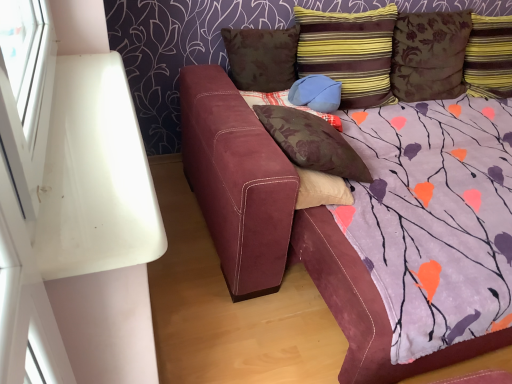
Where is `suede couch at center`? Image resolution: width=512 pixels, height=384 pixels. suede couch at center is located at coordinates (286, 228).

Identify the location of striped fabric pillow at upper right, the sixth pillow positioned from the left. (489, 57).

Measure the distance between floral fabric pillow at center, positioned as the 2th pillow in left-to-right order, and camera.

The distance of floral fabric pillow at center, positioned as the 2th pillow in left-to-right order, from camera is 4.74 feet.

This screenshot has width=512, height=384. What do you see at coordinates (349, 52) in the screenshot?
I see `striped fabric pillow at upper right, the 3th pillow viewed from the right` at bounding box center [349, 52].

Locate an element on the screen. The height and width of the screenshot is (384, 512). brown floral pillow at upper center, positioned as the sixth pillow in right-to-left order is located at coordinates (262, 58).

Is brown floral pillow at upper center, the 1th pillow positioned from the left, a part of brown floral pillow at upper right, placed as the second pillow when sorted from right to left?

No, brown floral pillow at upper center, the 1th pillow positioned from the left, is not surrounded by brown floral pillow at upper right, placed as the second pillow when sorted from right to left.

From the brown floral pillow at upper right, the 5th pillow positioned from the left, count the 4th pillow to the left and point to it. Please provide its 2D coordinates.

[(262, 58)]

From the picture: In terms of size, does brown floral pillow at upper right, placed as the second pillow when sorted from right to left, appear bigger or smaller than brown floral pillow at upper center, positioned as the sixth pillow in right-to-left order?

Clearly, brown floral pillow at upper right, placed as the second pillow when sorted from right to left, is larger in size than brown floral pillow at upper center, positioned as the sixth pillow in right-to-left order.

From the image's perspective, is brown floral pillow at upper right, the 5th pillow positioned from the left, beneath brown floral pillow at upper center, positioned as the sixth pillow in right-to-left order?

No.

Is brown floral pillow at upper right, the 5th pillow positioned from the left, wider or thinner than striped fabric pillow at upper right, which appears as the fourth pillow when viewed from the left?

Clearly, brown floral pillow at upper right, the 5th pillow positioned from the left, has less width compared to striped fabric pillow at upper right, which appears as the fourth pillow when viewed from the left.

Which object is positioned more to the left, brown floral pillow at upper right, the 5th pillow positioned from the left, or striped fabric pillow at upper right, the 3th pillow viewed from the right?

Positioned to the left is striped fabric pillow at upper right, the 3th pillow viewed from the right.

Considering the sizes of objects brown floral pillow at upper right, the 5th pillow positioned from the left, and striped fabric pillow at upper right, the 3th pillow viewed from the right, in the image provided, who is bigger, brown floral pillow at upper right, the 5th pillow positioned from the left, or striped fabric pillow at upper right, the 3th pillow viewed from the right,?

With larger size is striped fabric pillow at upper right, the 3th pillow viewed from the right.

Can you tell me how much brown floral pillow at upper right, placed as the second pillow when sorted from right to left, and suede couch at center differ in facing direction?

There is a 88.1-degree angle between the facing directions of brown floral pillow at upper right, placed as the second pillow when sorted from right to left, and suede couch at center.

Find the location of a particular element. The image size is (512, 384). studio couch that appears below the brown floral pillow at upper right, the 5th pillow positioned from the left (from the image's perspective) is located at coordinates (286, 228).

Which is correct: brown floral pillow at upper right, placed as the second pillow when sorted from right to left, is inside suede couch at center, or outside of it?

brown floral pillow at upper right, placed as the second pillow when sorted from right to left, lies outside suede couch at center.

Is brown floral pillow at upper right, placed as the second pillow when sorted from right to left, not near suede couch at center?

Absolutely, brown floral pillow at upper right, placed as the second pillow when sorted from right to left, is distant from suede couch at center.

From the image's perspective, is suede couch at center beneath brown floral pillow at upper center, positioned as the sixth pillow in right-to-left order?

Yes.

Would you consider suede couch at center to be distant from brown floral pillow at upper center, the 1th pillow positioned from the left?

They are positioned close to each other.

Is suede couch at center completely or partially outside of brown floral pillow at upper center, positioned as the sixth pillow in right-to-left order?

Yes.

Is suede blue pillow at center, the 4th pillow from the right, closer to camera compared to brown floral pillow at upper center, the 1th pillow positioned from the left?

Yes, suede blue pillow at center, the 4th pillow from the right, is closer to the viewer.

Considering the relative positions of suede blue pillow at center, the third pillow when ordered from left to right, and brown floral pillow at upper center, the 1th pillow positioned from the left, in the image provided, is suede blue pillow at center, the third pillow when ordered from left to right, to the right of brown floral pillow at upper center, the 1th pillow positioned from the left, from the viewer's perspective?

Indeed, suede blue pillow at center, the third pillow when ordered from left to right, is positioned on the right side of brown floral pillow at upper center, the 1th pillow positioned from the left.

From a real-world perspective, relative to brown floral pillow at upper center, the 1th pillow positioned from the left, is suede blue pillow at center, the third pillow when ordered from left to right, vertically above or below?

From a real-world perspective, suede blue pillow at center, the third pillow when ordered from left to right, is physically below brown floral pillow at upper center, the 1th pillow positioned from the left.

Does point (312, 95) lie in front of point (271, 57)?

Yes, point (312, 95) is in front of point (271, 57).

Which is farther, [307,42] or [475,45]?

The point [475,45] is farther.

What's the angular difference between striped fabric pillow at upper right, which appears as the fourth pillow when viewed from the left, and striped fabric pillow at upper right, the sixth pillow positioned from the left,'s facing directions?

They differ by 0.000348 degrees in their facing directions.

Can you confirm if striped fabric pillow at upper right, which appears as the fourth pillow when viewed from the left, is shorter than striped fabric pillow at upper right, the sixth pillow positioned from the left?

No, striped fabric pillow at upper right, which appears as the fourth pillow when viewed from the left, is not shorter than striped fabric pillow at upper right, the sixth pillow positioned from the left.

Looking at their sizes, would you say striped fabric pillow at upper right, the 3th pillow viewed from the right, is wider or thinner than striped fabric pillow at upper right, the sixth pillow positioned from the left?

striped fabric pillow at upper right, the 3th pillow viewed from the right, is wider than striped fabric pillow at upper right, the sixth pillow positioned from the left.

Is suede couch at center behind striped fabric pillow at upper right, which appears as the fourth pillow when viewed from the left?

That is False.

Is suede couch at center wider than striped fabric pillow at upper right, the 3th pillow viewed from the right?

Correct, the width of suede couch at center exceeds that of striped fabric pillow at upper right, the 3th pillow viewed from the right.

Could you tell me if suede couch at center is facing striped fabric pillow at upper right, which appears as the fourth pillow when viewed from the left?

No.

From the image's perspective, starting from the brown floral pillow at upper right, the 5th pillow positioned from the left, which pillow is the 2nd one below? Please provide its 2D coordinates.

[(262, 58)]

Where is `the 3rd pillow in front of the brown floral pillow at upper right, the 5th pillow positioned from the left, counting from the anchor's position`? This screenshot has width=512, height=384. the 3rd pillow in front of the brown floral pillow at upper right, the 5th pillow positioned from the left, counting from the anchor's position is located at coordinates (349, 52).

Estimate the real-world distances between objects in this image. Which object is closer to suede couch at center, brown floral pillow at upper right, the 5th pillow positioned from the left, or floral fabric pillow at center, positioned as the 2th pillow in left-to-right order?

floral fabric pillow at center, positioned as the 2th pillow in left-to-right order, is closer to suede couch at center.

Considering their positions, is suede blue pillow at center, the 4th pillow from the right, positioned further to striped fabric pillow at upper right, the sixth pillow positioned from the left, than brown floral pillow at upper center, positioned as the sixth pillow in right-to-left order?

Among the two, brown floral pillow at upper center, positioned as the sixth pillow in right-to-left order, is located further to striped fabric pillow at upper right, the sixth pillow positioned from the left.

Based on their spatial positions, is brown floral pillow at upper center, positioned as the sixth pillow in right-to-left order, or striped fabric pillow at upper right, the 3th pillow viewed from the right, closer to suede couch at center?

brown floral pillow at upper center, positioned as the sixth pillow in right-to-left order, is closer to suede couch at center.

Which object lies further to the anchor point brown floral pillow at upper right, the 5th pillow positioned from the left, suede couch at center or floral fabric pillow at center, positioned as the 2th pillow in left-to-right order?

suede couch at center lies further to brown floral pillow at upper right, the 5th pillow positioned from the left, than the other object.

Considering their positions, is brown floral pillow at upper center, the 1th pillow positioned from the left, positioned closer to brown floral pillow at upper right, placed as the second pillow when sorted from right to left, than floral fabric pillow at center, which ranks as the 5th pillow in right-to-left order?

brown floral pillow at upper center, the 1th pillow positioned from the left, lies closer to brown floral pillow at upper right, placed as the second pillow when sorted from right to left, than the other object.

Estimate the real-world distances between objects in this image. Which object is closer to brown floral pillow at upper center, positioned as the sixth pillow in right-to-left order, striped fabric pillow at upper right, which appears as the first pillow when viewed from the right, or floral fabric pillow at center, which ranks as the 5th pillow in right-to-left order?

floral fabric pillow at center, which ranks as the 5th pillow in right-to-left order, lies closer to brown floral pillow at upper center, positioned as the sixth pillow in right-to-left order, than the other object.

In the scene shown: Considering their positions, is striped fabric pillow at upper right, the 3th pillow viewed from the right, positioned closer to striped fabric pillow at upper right, the sixth pillow positioned from the left, than suede blue pillow at center, the 4th pillow from the right?

The object closer to striped fabric pillow at upper right, the sixth pillow positioned from the left, is striped fabric pillow at upper right, the 3th pillow viewed from the right.

When comparing their distances from brown floral pillow at upper center, positioned as the sixth pillow in right-to-left order, does suede couch at center or suede blue pillow at center, the 4th pillow from the right, seem closer?

suede blue pillow at center, the 4th pillow from the right, is closer to brown floral pillow at upper center, positioned as the sixth pillow in right-to-left order.

Where is `studio couch between brown floral pillow at upper center, positioned as the sixth pillow in right-to-left order, and striped fabric pillow at upper right, which appears as the first pillow when viewed from the right, in the horizontal direction`? This screenshot has height=384, width=512. studio couch between brown floral pillow at upper center, positioned as the sixth pillow in right-to-left order, and striped fabric pillow at upper right, which appears as the first pillow when viewed from the right, in the horizontal direction is located at coordinates (286, 228).

The image size is (512, 384). Find the location of `pillow between suede blue pillow at center, the third pillow when ordered from left to right, and brown floral pillow at upper right, the 5th pillow positioned from the left, from left to right`. pillow between suede blue pillow at center, the third pillow when ordered from left to right, and brown floral pillow at upper right, the 5th pillow positioned from the left, from left to right is located at coordinates (349, 52).

At what (x,y) coordinates should I click in order to perform the action: click on pillow that lies between brown floral pillow at upper center, the 1th pillow positioned from the left, and floral fabric pillow at center, which ranks as the 5th pillow in right-to-left order, from top to bottom. Please return your answer as a coordinate pair (x, y). The height and width of the screenshot is (384, 512). Looking at the image, I should click on (316, 93).

This screenshot has width=512, height=384. Identify the location of pillow located between striped fabric pillow at upper right, which appears as the fourth pillow when viewed from the left, and striped fabric pillow at upper right, which appears as the first pillow when viewed from the right, in the left-right direction. point(429,55).